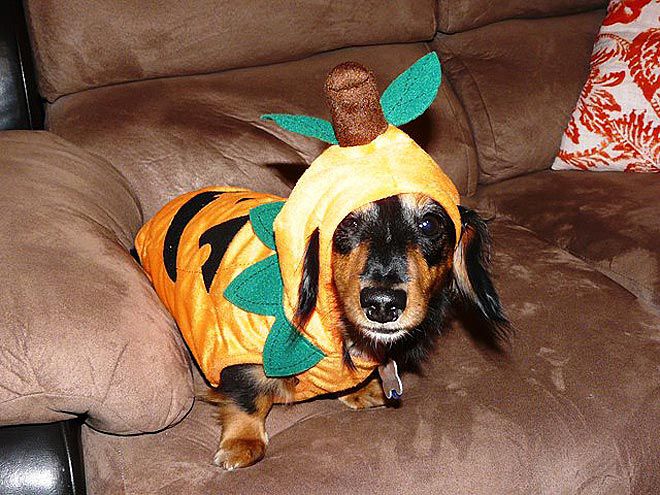
The height and width of the screenshot is (495, 660). What are the coordinates of `couch rest` in the screenshot? It's located at (241, 19).